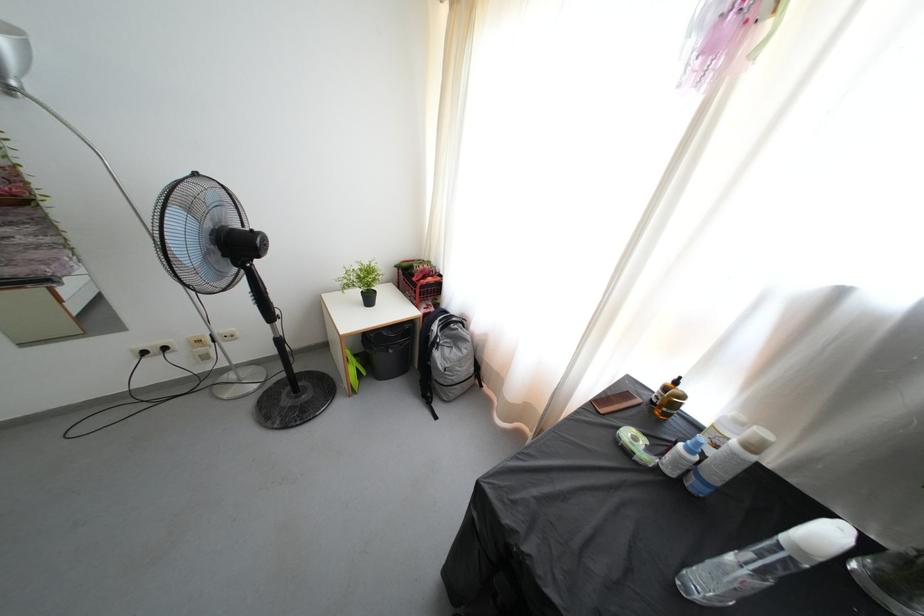
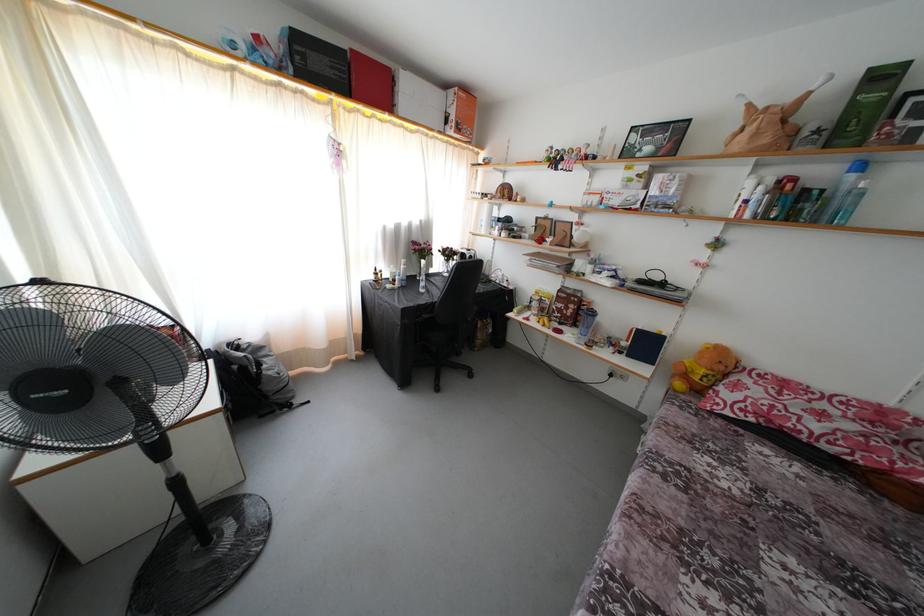
Locate, in the second image, the point that corresponds to pixel 442 391 in the first image.

(281, 403)